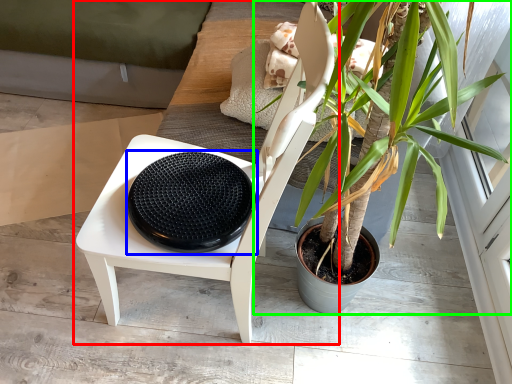
Question: Which is farther away from chair (highlighted by a red box)? footrest (highlighted by a blue box) or houseplant (highlighted by a green box)?

Choices:
 (A) footrest
 (B) houseplant

Answer: (B)